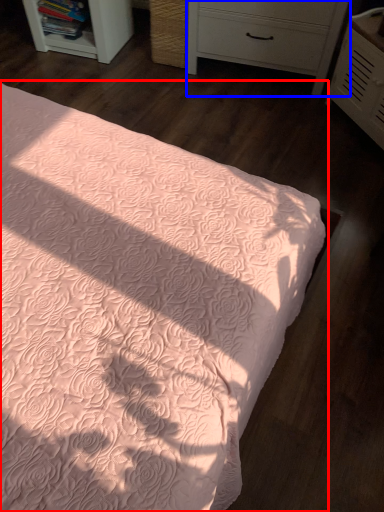
Question: Which object appears closest to the camera in this image, bed (highlighted by a red box) or chest of drawers (highlighted by a blue box)?

Choices:
 (A) bed
 (B) chest of drawers

Answer: (A)